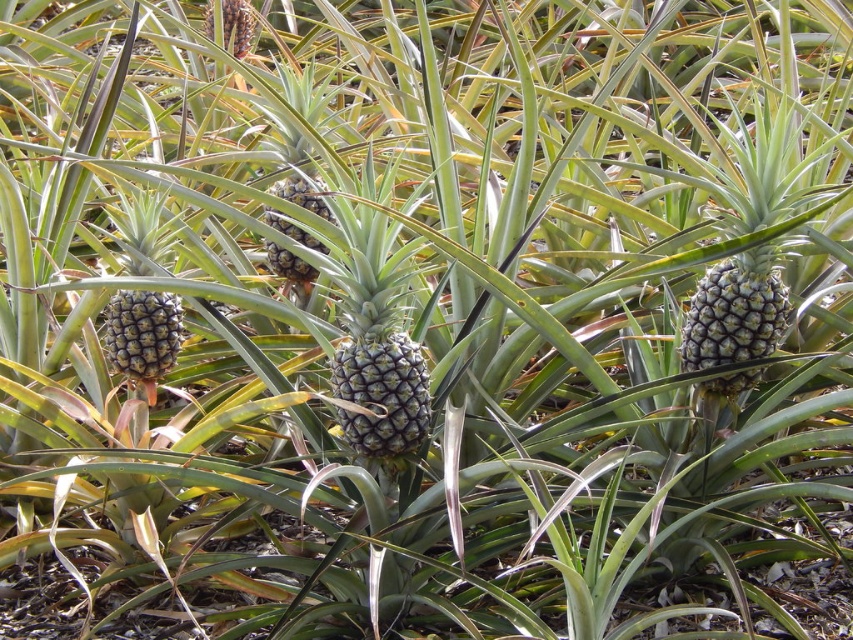
Between green textured pineapple at left and green textured pineapple at center, which one is positioned lower?

Positioned lower is green textured pineapple at left.

Does green textured pineapple at left appear under green textured pineapple at center?

Indeed, green textured pineapple at left is positioned under green textured pineapple at center.

Between point (152, 252) and point (306, 172), which one is positioned behind?

The point (306, 172) is behind.

Where is `green textured pineapple at left`? green textured pineapple at left is located at coordinates tap(143, 333).

Is green textured pineapple at left below spongy brown pineapple at upper center?

Correct, green textured pineapple at left is located below spongy brown pineapple at upper center.

Which is in front, point (172, 333) or point (231, 35)?

Point (172, 333) is in front.

In order to click on green textured pineapple at left in this screenshot , I will do `click(143, 333)`.

Does green textured pineapple at center appear over spongy brown pineapple at upper center?

Incorrect, green textured pineapple at center is not positioned above spongy brown pineapple at upper center.

Does green textured pineapple at center appear on the left side of spongy brown pineapple at upper center?

In fact, green textured pineapple at center is to the right of spongy brown pineapple at upper center.

Which is behind, point (297, 166) or point (221, 3)?

Point (221, 3)

Where is `green textured pineapple at center`? The height and width of the screenshot is (640, 853). green textured pineapple at center is located at coordinates (305, 92).